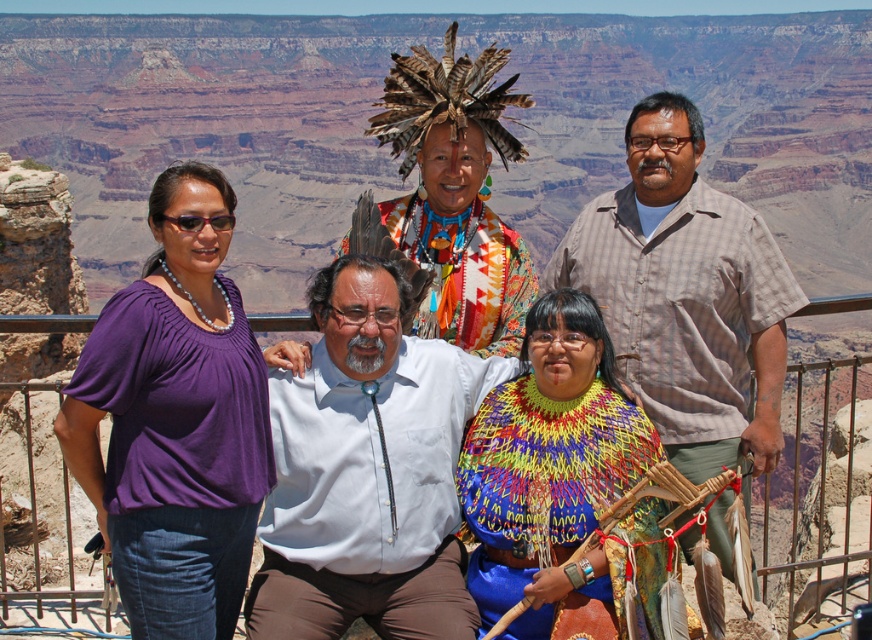
Does purple fabric shirt at left have a greater width compared to multicolored woven shawl at center?

Correct, the width of purple fabric shirt at left exceeds that of multicolored woven shawl at center.

Identify the location of purple fabric shirt at left. (175, 420).

Which of these two, purple fabric shirt at left or white cotton shirt at center, stands taller?

Standing taller between the two is purple fabric shirt at left.

Can you confirm if purple fabric shirt at left is positioned to the right of white cotton shirt at center?

In fact, purple fabric shirt at left is to the left of white cotton shirt at center.

This screenshot has height=640, width=872. Describe the element at coordinates (175, 420) in the screenshot. I see `purple fabric shirt at left` at that location.

This screenshot has width=872, height=640. What are the coordinates of `purple fabric shirt at left` in the screenshot? It's located at (175, 420).

Find the location of `white cotton shirt at center`. white cotton shirt at center is located at coordinates (366, 470).

Which is more to the left, white cotton shirt at center or multicolored woven shawl at center?

From the viewer's perspective, white cotton shirt at center appears more on the left side.

Measure the distance between point (365,556) and camera.

Point (365,556) is 24.01 meters from camera.

Identify the location of white cotton shirt at center. Image resolution: width=872 pixels, height=640 pixels. (366, 470).